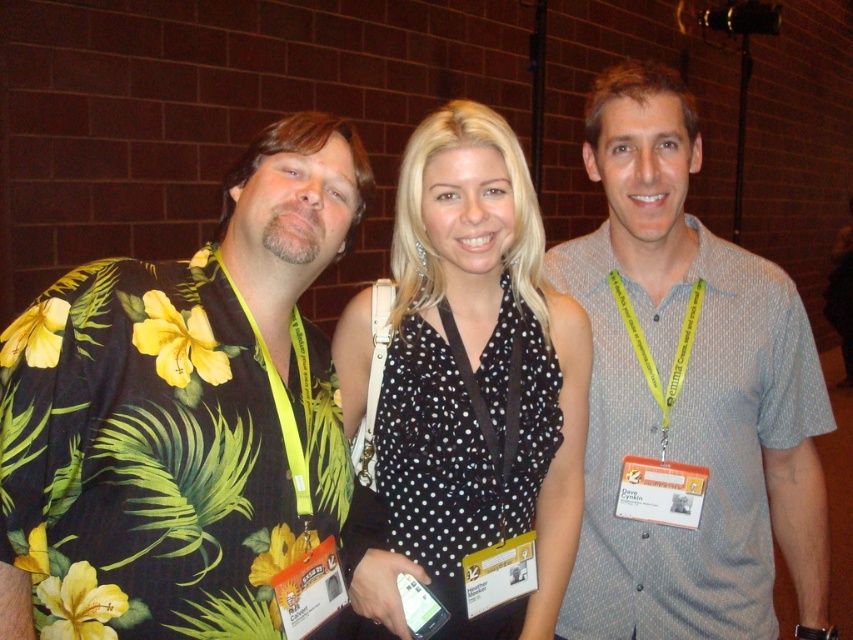
Question: Among these objects, which one is nearest to the camera?

Choices:
 (A) floral print shirt at left
 (B) yellow fabric lanyard at left
 (C) gray dotted shirt at center
 (D) black dotted blouse at center

Answer: (A)

Question: Is gray dotted shirt at center to the left of black dotted blouse at center from the viewer's perspective?

Choices:
 (A) yes
 (B) no

Answer: (B)

Question: Is gray dotted shirt at center positioned before black dotted blouse at center?

Choices:
 (A) yes
 (B) no

Answer: (B)

Question: Among these points, which one is nearest to the camera?

Choices:
 (A) (815, 620)
 (B) (296, 342)
 (C) (445, 508)
 (D) (38, 412)

Answer: (D)

Question: Can you confirm if floral print shirt at left is wider than black dotted blouse at center?

Choices:
 (A) yes
 (B) no

Answer: (B)

Question: Which point is closer to the camera taking this photo?

Choices:
 (A) (410, 444)
 (B) (605, 170)
 (C) (267, 369)
 (D) (321, 515)

Answer: (C)